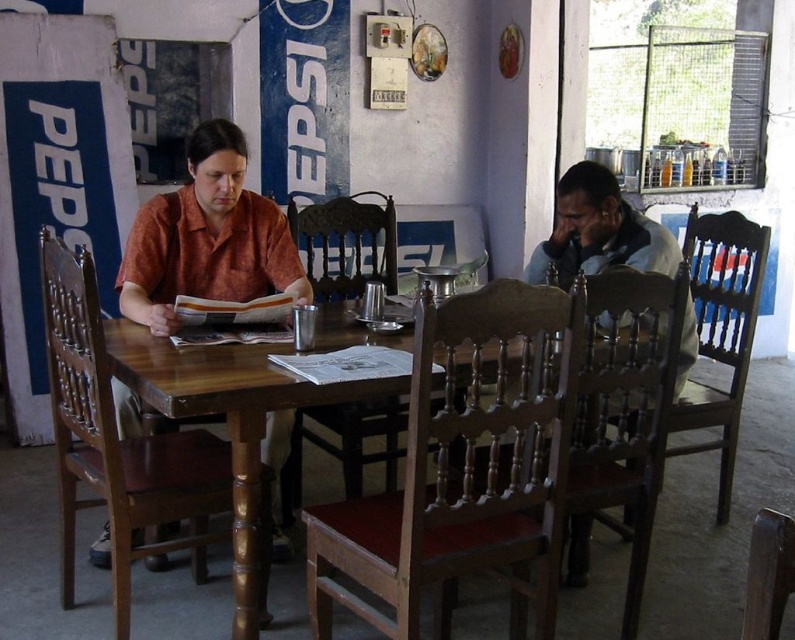
Is brown wood chair at center bigger than wooden chair at right?

No.

Which is in front, point (560, 317) or point (741, 332)?

Point (560, 317) is more forward.

Is point (332, 548) behind point (697, 291)?

No.

Locate an element on the screen. brown wood chair at center is located at coordinates (464, 468).

Between point (134, 385) and point (386, 449), which one is positioned behind?

The point (386, 449) is more distant.

Measure the distance between point (313,403) and camera.

A distance of 6.29 feet exists between point (313,403) and camera.

The width and height of the screenshot is (795, 640). What do you see at coordinates (227, 420) in the screenshot?
I see `wooden table at center` at bounding box center [227, 420].

Identify the location of wooden table at center. The height and width of the screenshot is (640, 795). (227, 420).

Does brown wood chair at center have a greater width compared to brown wood chair at left?

Yes.

You are a GUI agent. You are given a task and a screenshot of the screen. Output one action in this format:
    pyautogui.click(x=<x>, y=<y>)
    Task: Click on the brown wood chair at center
    Image resolution: width=795 pixels, height=640 pixels.
    Given the screenshot: What is the action you would take?
    pyautogui.click(x=464, y=468)